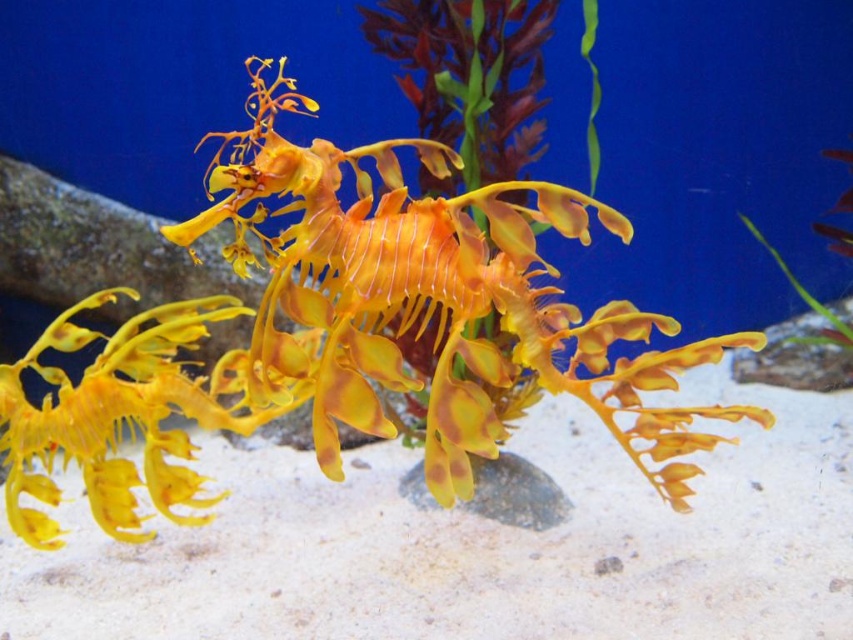
You are observing an underwater scene with two points marked as point 1 at coordinates (273,342) and point 2 at coordinates (761,241). Which point is nearer to you?

Point 1 at coordinates (273,342) is closer to the camera than point 2 at coordinates (761,241), so point 1 is nearer to you.